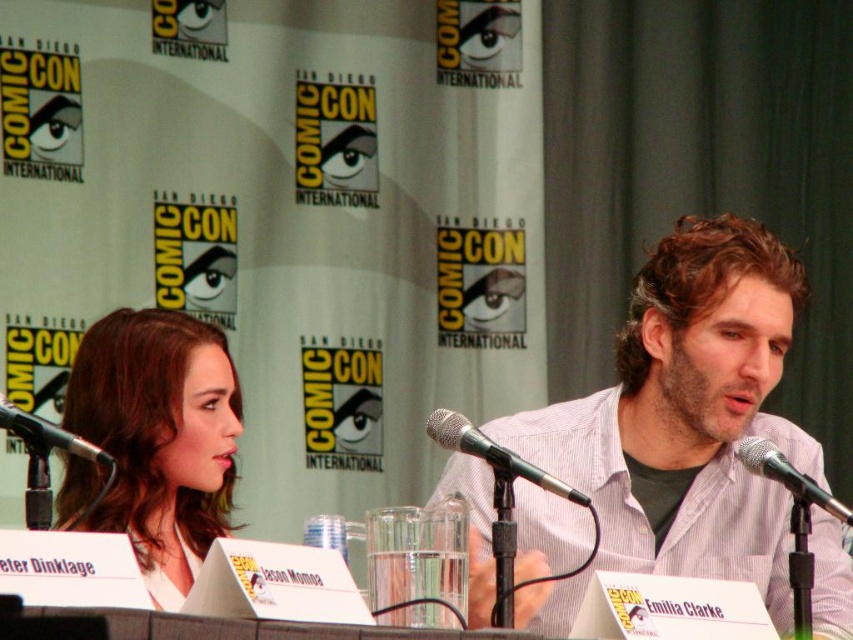
Looking at this image, you are an attendee at Comic Con and want to ask a question to the person with smooth brown hair at center. The black metallic microphone at center is the only one working. Can you tell based on their positions if the microphone is near enough for the person to speak into it comfortably?

The smooth brown hair at center is positioned under black metallic microphone at center, so the microphone is likely close enough for the person to speak into it comfortably.

You are a photographer at Comic Con and you want to take a photo of the two people at the table. You notice the smooth brown hair at center and the black metallic microphone at center. Which object is wider in the frame?

The smooth brown hair at center is wider than the black metallic microphone at center according to the description provided.